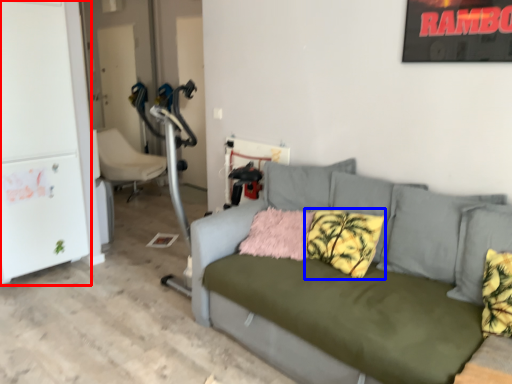
Question: Which point is further to the camera, fridge (highlighted by a red box) or pillow (highlighted by a blue box)?

Choices:
 (A) fridge
 (B) pillow

Answer: (A)